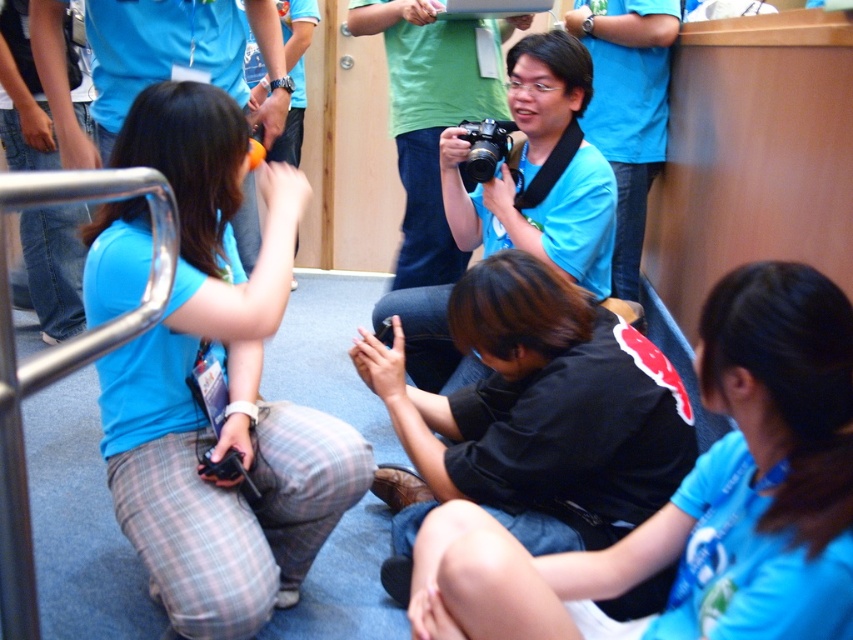
Question: Where is matte blue shirt at left located in relation to black plastic camera at center in the image?

Choices:
 (A) left
 (B) right

Answer: (A)

Question: Considering the real-world distances, which object is farthest from the black matte shirt at center?

Choices:
 (A) black plastic camera at center
 (B) matte blue shirt at left
 (C) matte blue camera at center

Answer: (A)

Question: Can you confirm if matte blue shirt at left is smaller than matte blue camera at center?

Choices:
 (A) no
 (B) yes

Answer: (B)

Question: Is matte blue shirt at left bigger than black plastic camera at center?

Choices:
 (A) yes
 (B) no

Answer: (A)

Question: Which point is closer to the camera?

Choices:
 (A) (480, 125)
 (B) (172, 300)
 (C) (450, 369)
 (D) (834, 586)

Answer: (D)

Question: Among these points, which one is nearest to the camera?

Choices:
 (A) (490, 166)
 (B) (404, 316)

Answer: (A)